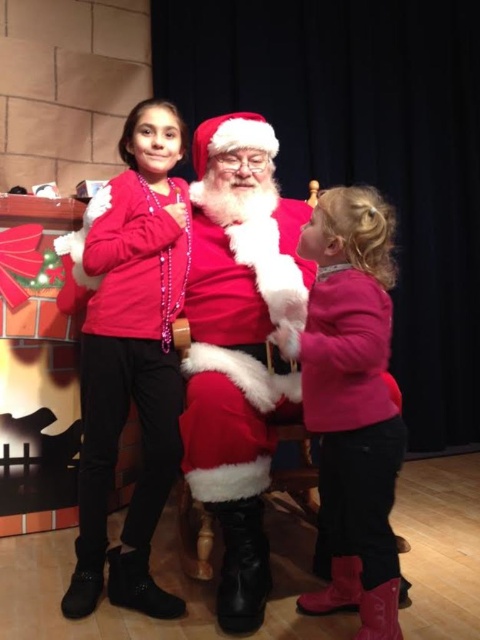
Is the point at coordinate (x=132, y=358) located on the matte red sweater at left?

Yes, the point at coordinate (x=132, y=358) is located on the matte red sweater at left.